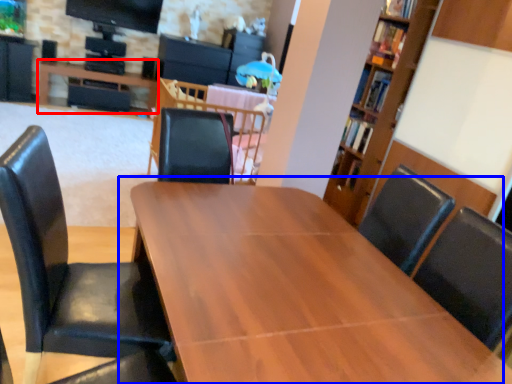
Question: Which of the following is the closest to the observer, table (highlighted by a red box) or table (highlighted by a blue box)?

Choices:
 (A) table
 (B) table

Answer: (B)